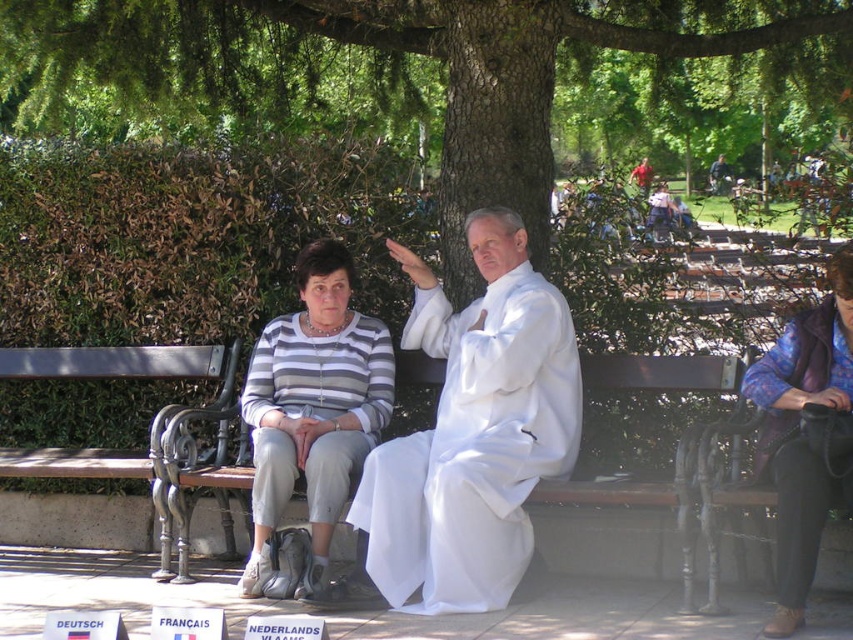
Question: Considering the relative positions of green leafy tree at center and white cloth at center in the image provided, where is green leafy tree at center located with respect to white cloth at center?

Choices:
 (A) right
 (B) left

Answer: (B)

Question: Which of the following is the closest to the observer?

Choices:
 (A) (164, 353)
 (B) (61, 65)
 (C) (505, 262)

Answer: (C)

Question: Does matte purple robe at lower right have a smaller size compared to brown wooden bench at center?

Choices:
 (A) yes
 (B) no

Answer: (A)

Question: Is white cloth at center thinner than brown wooden bench at center?

Choices:
 (A) yes
 (B) no

Answer: (B)

Question: Which point appears closest to the camera in this image?

Choices:
 (A) (169, 58)
 (B) (218, 365)

Answer: (B)

Question: Among these objects, which one is farthest from the camera?

Choices:
 (A) striped knit sweater at center
 (B) green leafy tree at center
 (C) brown wooden bench at center
 (D) white cloth at center

Answer: (B)